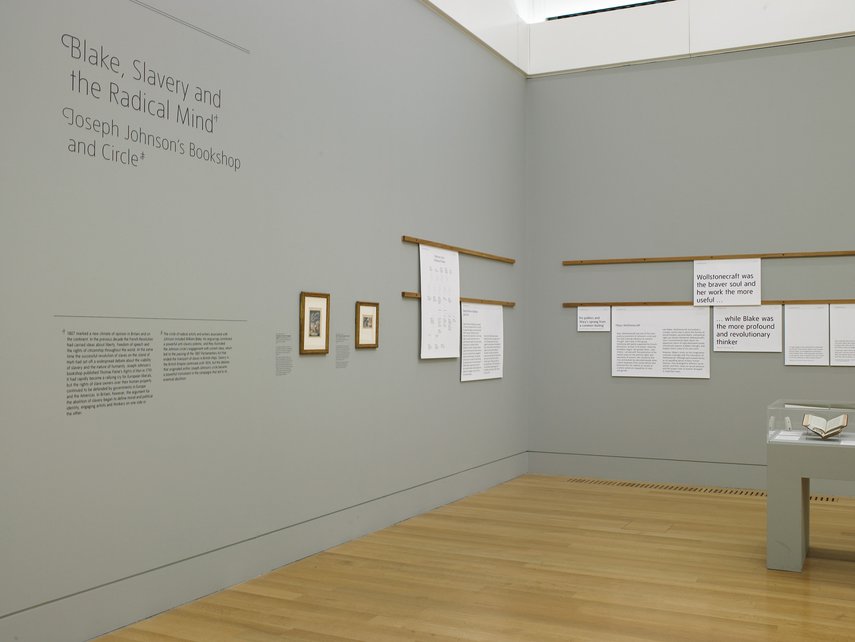
The height and width of the screenshot is (642, 855). I want to click on 1 clear display case, so click(x=799, y=422).